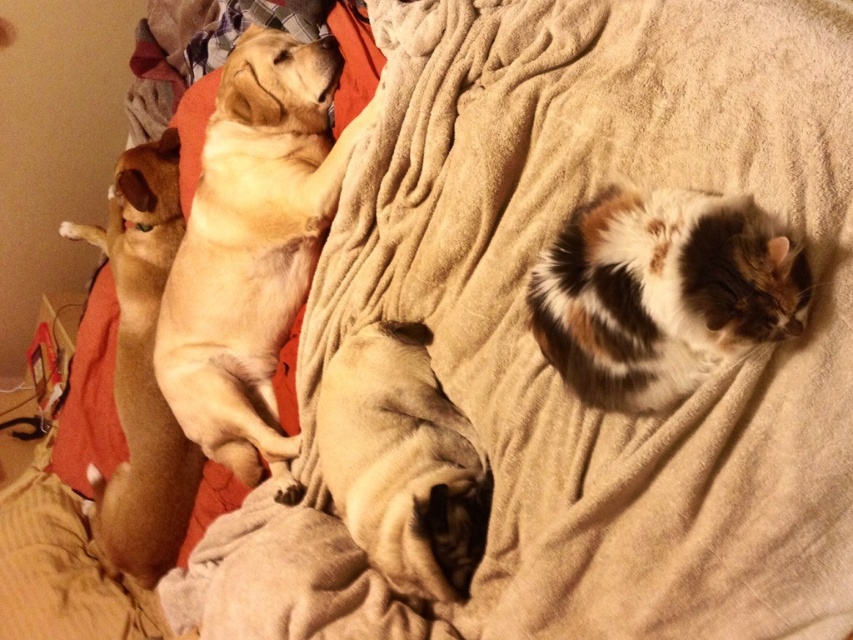
Question: Which object is the farthest from the brown furry dog at left?

Choices:
 (A) golden fur dog at center
 (B) calico fur cat at right
 (C) brown soft pug at center

Answer: (B)

Question: Can you confirm if golden fur dog at center is positioned to the right of brown soft pug at center?

Choices:
 (A) no
 (B) yes

Answer: (A)

Question: Is the position of golden fur dog at center more distant than that of brown soft pug at center?

Choices:
 (A) no
 (B) yes

Answer: (B)

Question: Which of the following is the farthest from the observer?

Choices:
 (A) brown soft pug at center
 (B) brown furry dog at left
 (C) golden fur dog at center

Answer: (B)

Question: Considering the relative positions of brown soft pug at center and brown furry dog at left in the image provided, where is brown soft pug at center located with respect to brown furry dog at left?

Choices:
 (A) above
 (B) below

Answer: (B)

Question: Which point is closer to the camera?

Choices:
 (A) brown soft pug at center
 (B) calico fur cat at right
 (C) golden fur dog at center

Answer: (B)